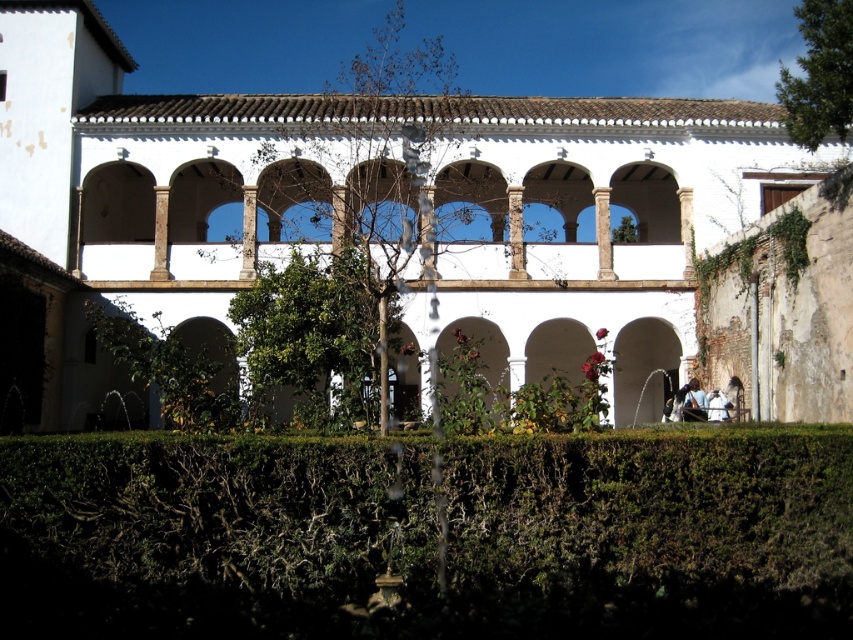
Question: Estimate the real-world distances between objects in this image. Which object is farther from the green leafy hedge at lower center?

Choices:
 (A) green stone archway at lower left
 (B) white stone archway at center

Answer: (B)

Question: Which point is closer to the camera taking this photo?

Choices:
 (A) (187, 172)
 (B) (651, 321)
 (C) (534, 376)

Answer: (A)

Question: Which object appears farthest from the camera in this image?

Choices:
 (A) white stone archway at center
 (B) green stone archway at center
 (C) green stone archway at lower left

Answer: (A)

Question: Can you confirm if green stone archway at lower left is thinner than green stone archway at center?

Choices:
 (A) no
 (B) yes

Answer: (A)

Question: In this image, where is green leafy hedge at lower center located relative to green stone archway at center?

Choices:
 (A) above
 (B) below

Answer: (B)

Question: Does white stone building at center have a larger size compared to green stone archway at lower left?

Choices:
 (A) yes
 (B) no

Answer: (A)